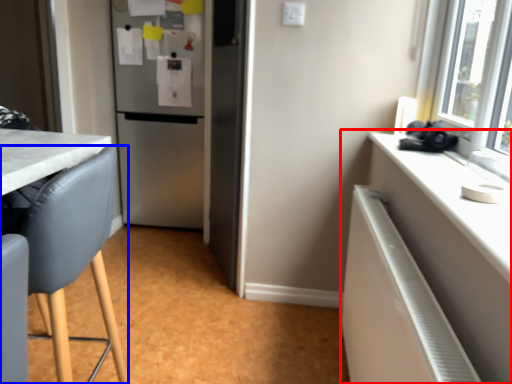
Question: Which of the following is the closest to the observer, cabinetry (highlighted by a red box) or chair (highlighted by a blue box)?

Choices:
 (A) cabinetry
 (B) chair

Answer: (A)